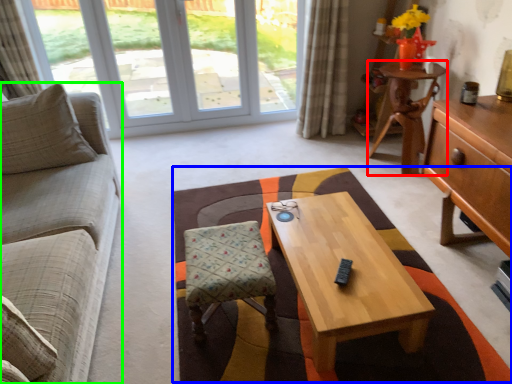
Question: Which object is the farthest from desk (highlighted by a red box)? Choose among these: blanket (highlighted by a blue box) or studio couch (highlighted by a green box).

Choices:
 (A) blanket
 (B) studio couch

Answer: (B)